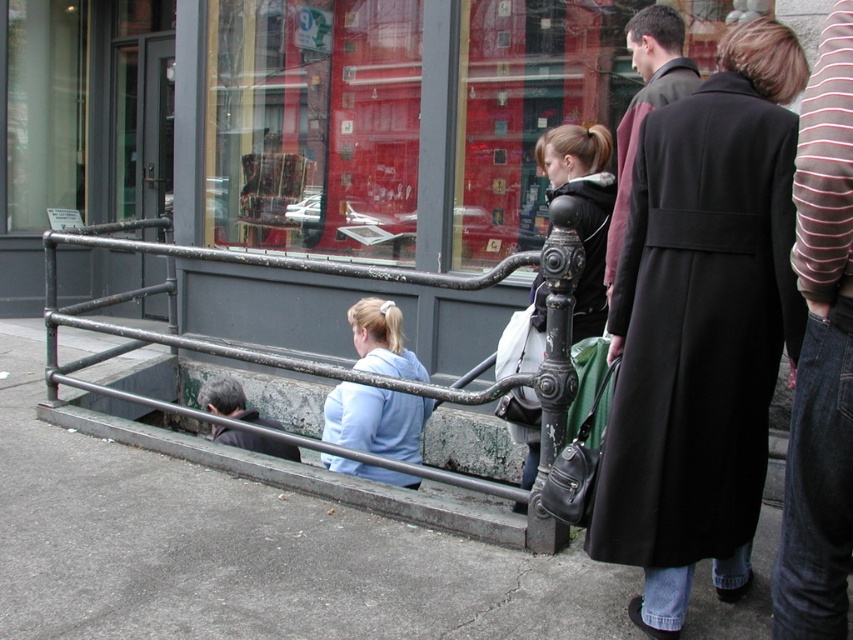
You are a photographer trying to capture a group photo of the black wool coat at right and the light blue hoodie at center. If you want to ensure both subjects are fully visible in the frame without cropping, which subject should you position closer to the camera to maintain their full visibility?

The black wool coat at right has a lesser width compared to light blue hoodie at center. To ensure both are fully visible, position the black wool coat at right closer to the camera since it is narrower and requires less space in the frame.

Looking at this image, you are standing at the bottom of the steps and want to approach both the black wool coat at right and the light blue hoodie at center. Which one should you walk towards first to reach the one closer to you?

The black wool coat at right is closer to the viewer than the light blue hoodie at center, so you should walk towards the black wool coat at right first.